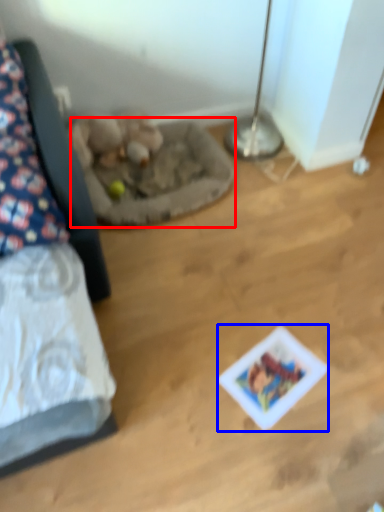
Question: Which object appears farthest to the camera in this image, cat bed (highlighted by a red box) or card game (highlighted by a blue box)?

Choices:
 (A) cat bed
 (B) card game

Answer: (A)